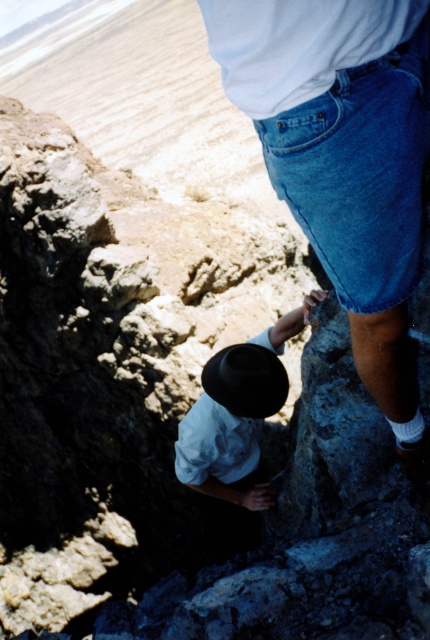
Can you confirm if denim shorts at center is positioned to the right of black felt hat at center?

Indeed, denim shorts at center is positioned on the right side of black felt hat at center.

I want to click on denim shorts at center, so click(359, 172).

Between point (381, 308) and point (218, 397), which one is positioned in front?

Point (381, 308)

Is denim shorts at center shorter than white cotton shirt at center?

Yes.

I want to click on denim shorts at center, so click(x=359, y=172).

Is point (240, 422) less distant than point (272, 362)?

No, it is not.

Is point (236, 360) farther from camera compared to point (248, 355)?

No, (236, 360) is closer to viewer.

Who is more distant from viewer, (297, 314) or (232, 365)?

Point (297, 314)

Where is `white cotton shirt at center`? The width and height of the screenshot is (430, 640). white cotton shirt at center is located at coordinates (237, 412).